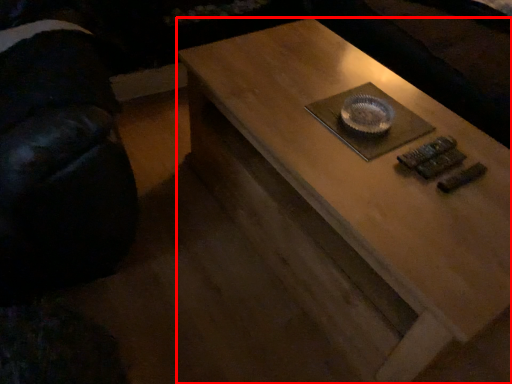
Question: From the image, what is the correct spatial relationship of coffee table (annotated by the red box) in relation to swivel chair?

Choices:
 (A) right
 (B) left

Answer: (A)